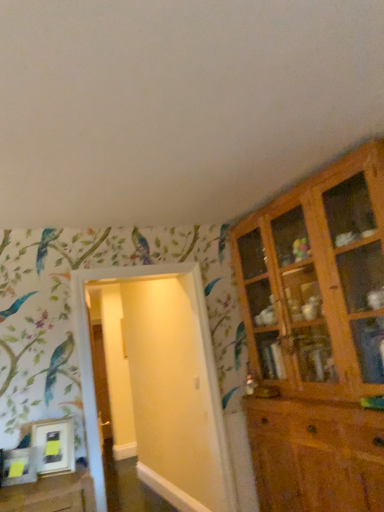
Question: Considering the relative positions of white glossy door at center and wooden cabinet at right in the image provided, is white glossy door at center to the right of wooden cabinet at right from the viewer's perspective?

Choices:
 (A) no
 (B) yes

Answer: (A)

Question: From a real-world perspective, is white glossy door at center positioned over wooden cabinet at right based on gravity?

Choices:
 (A) yes
 (B) no

Answer: (B)

Question: From a real-world perspective, is white glossy door at center physically below wooden cabinet at right?

Choices:
 (A) no
 (B) yes

Answer: (B)

Question: Does white glossy door at center have a larger size compared to wooden cabinet at right?

Choices:
 (A) no
 (B) yes

Answer: (A)

Question: From the image's perspective, is white glossy door at center over wooden cabinet at right?

Choices:
 (A) no
 (B) yes

Answer: (A)

Question: Is white glossy door at center not inside wooden cabinet at right?

Choices:
 (A) yes
 (B) no

Answer: (A)

Question: From a real-world perspective, does wooden cabinet at right stand above white glossy door at center?

Choices:
 (A) no
 (B) yes

Answer: (B)

Question: Considering the relative sizes of wooden cabinet at right and white glossy door at center in the image provided, is wooden cabinet at right bigger than white glossy door at center?

Choices:
 (A) no
 (B) yes

Answer: (B)

Question: From the image's perspective, is wooden cabinet at right below white glossy door at center?

Choices:
 (A) no
 (B) yes

Answer: (A)

Question: Is wooden cabinet at right positioned far away from white glossy door at center?

Choices:
 (A) no
 (B) yes

Answer: (A)

Question: Is wooden cabinet at right outside white glossy door at center?

Choices:
 (A) no
 (B) yes

Answer: (B)

Question: Is wooden cabinet at right facing away from white glossy door at center?

Choices:
 (A) yes
 (B) no

Answer: (B)

Question: Considering the positions of white glossy door at center and wooden cabinet at right in the image, is white glossy door at center wider or thinner than wooden cabinet at right?

Choices:
 (A) wide
 (B) thin

Answer: (B)